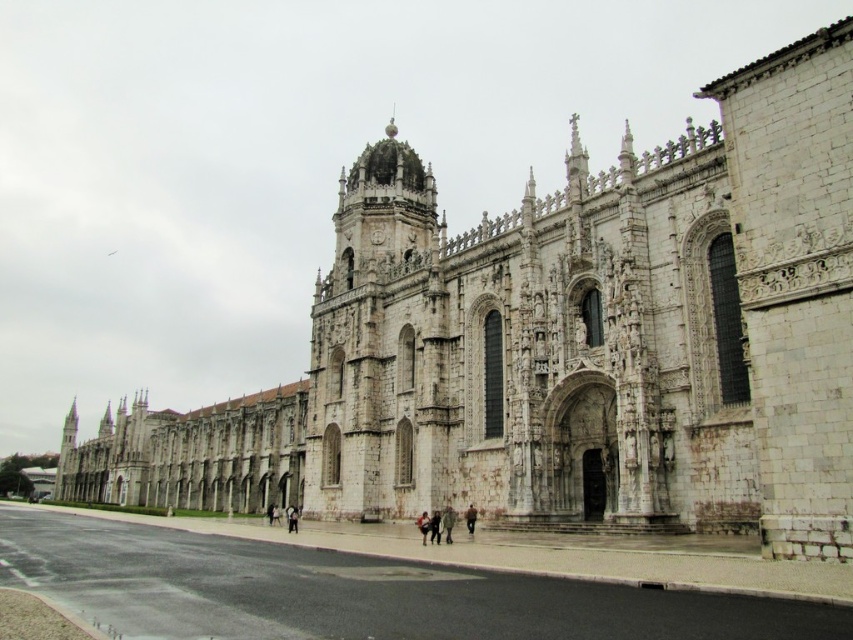
Question: Which point is farther to the camera?

Choices:
 (A) light brown leather jacket at center
 (B) dark brown leather jacket at lower center
 (C) dark gray fabric coat at center

Answer: (A)

Question: Is dark gray fabric coat at center positioned at the back of brown leather jacket at lower center?

Choices:
 (A) no
 (B) yes

Answer: (A)

Question: Where is light brown leather jacket at center located in relation to brown leather jacket at lower center in the image?

Choices:
 (A) below
 (B) above

Answer: (A)

Question: Is light brown leather jacket at center in front of dark gray fabric coat at lower center?

Choices:
 (A) no
 (B) yes

Answer: (B)

Question: Which point is farther from the camera taking this photo?

Choices:
 (A) (288, 531)
 (B) (444, 522)

Answer: (A)

Question: Among these points, which one is nearest to the camera?

Choices:
 (A) (428, 529)
 (B) (426, 518)

Answer: (A)